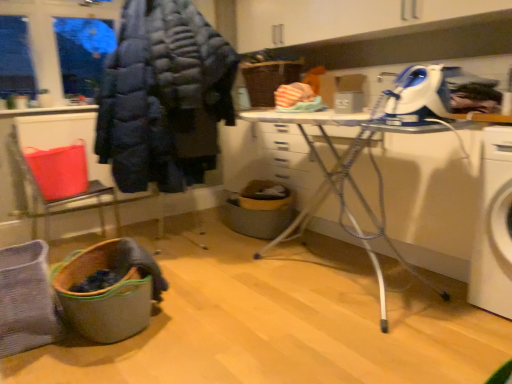
Find the location of a particular element. Image resolution: width=512 pixels, height=384 pixels. matte plastic chair at lower left is located at coordinates (61, 182).

This screenshot has height=384, width=512. What do you see at coordinates (309, 143) in the screenshot? I see `white plastic ironing board at center` at bounding box center [309, 143].

What is the approximate width of blue plastic iron at upper right?

blue plastic iron at upper right is 15.71 inches in width.

Describe the element at coordinates (418, 96) in the screenshot. I see `blue plastic iron at upper right` at that location.

Locate an element on the screen. wooden laundry basket at lower left is located at coordinates click(x=102, y=297).

Locate an element on the screen. The height and width of the screenshot is (384, 512). matte plastic chair at lower left is located at coordinates pyautogui.click(x=61, y=182).

Which is closer, (x=75, y=264) or (x=424, y=92)?

Point (x=75, y=264) appears to be farther away from the viewer than point (x=424, y=92).

Are wooden laundry basket at lower left and blue plastic iron at upper right beside each other?

No, wooden laundry basket at lower left is not making contact with blue plastic iron at upper right.

Is wooden laundry basket at lower left looking in the opposite direction of blue plastic iron at upper right?

That's not correct — wooden laundry basket at lower left is not looking away from blue plastic iron at upper right.

Is wooden laundry basket at lower left not within blue plastic iron at upper right?

Yes.

Visually, is white plastic ironing board at center positioned to the left or to the right of wooden laundry basket at lower left?

From the image, it's evident that white plastic ironing board at center is to the right of wooden laundry basket at lower left.

Would you say white plastic ironing board at center contains wooden laundry basket at lower left?

No, wooden laundry basket at lower left is not a part of white plastic ironing board at center.

In terms of height, does white plastic ironing board at center look taller or shorter compared to wooden laundry basket at lower left?

In the image, white plastic ironing board at center appears to be taller than wooden laundry basket at lower left.

Consider the image. Is white plastic ironing board at center placed right next to wooden laundry basket at lower left?

There is a gap between white plastic ironing board at center and wooden laundry basket at lower left.

Considering the positions of objects blue plastic iron at upper right and brown woven basket at center in the image provided, who is more to the right, blue plastic iron at upper right or brown woven basket at center?

blue plastic iron at upper right.

How many degrees apart are the facing directions of blue plastic iron at upper right and brown woven basket at center?

There is a 3.76-degree angle between the facing directions of blue plastic iron at upper right and brown woven basket at center.

Which is behind, point (387, 109) or point (255, 70)?

The point (255, 70) is behind.

Which of these two, blue plastic iron at upper right or brown woven basket at center, is thinner?

With smaller width is blue plastic iron at upper right.

Is wooden laundry basket at lower left to the right of dark blue puffer jacket at upper left from the viewer's perspective?

Incorrect, wooden laundry basket at lower left is not on the right side of dark blue puffer jacket at upper left.

Can you confirm if wooden laundry basket at lower left is wider than dark blue puffer jacket at upper left?

In fact, wooden laundry basket at lower left might be narrower than dark blue puffer jacket at upper left.

I want to click on laundry basket lying in front of the dark blue puffer jacket at upper left, so click(102, 297).

Find the location of a particular element. The height and width of the screenshot is (384, 512). sewing machine in front of the dark blue puffer jacket at upper left is located at coordinates (418, 96).

Which point is more distant from viewer, [184,86] or [432,90]?

The point [184,86] is behind.

From the image's perspective, does dark blue puffer jacket at upper left appear lower than blue plastic iron at upper right?

Incorrect, from the image's perspective, dark blue puffer jacket at upper left is higher than blue plastic iron at upper right.

Is dark blue puffer jacket at upper left directly adjacent to blue plastic iron at upper right?

No, dark blue puffer jacket at upper left is not with blue plastic iron at upper right.

Can brown woven basket at center be found inside wooden laundry basket at lower left?

No, brown woven basket at center is located outside of wooden laundry basket at lower left.

Considering the positions of points (58, 278) and (298, 63), is point (58, 278) closer to camera compared to point (298, 63)?

That is True.

Measure the distance from wooden laundry basket at lower left to brown woven basket at center.

wooden laundry basket at lower left is 1.91 meters away from brown woven basket at center.

Which object is closer to the camera taking this photo, wooden laundry basket at lower left or brown woven basket at center?

wooden laundry basket at lower left is more forward.

From a real-world perspective, is dark blue puffer jacket at upper left below brown woven basket at center?

Yes, from a real-world perspective, dark blue puffer jacket at upper left is beneath brown woven basket at center.

In the scene shown: From the image's perspective, is dark blue puffer jacket at upper left under brown woven basket at center?

Yes.

Is dark blue puffer jacket at upper left taller than brown woven basket at center?

Yes.

Find the location of a particular element. This screenshot has height=384, width=512. basket above the dark blue puffer jacket at upper left (from the image's perspective) is located at coordinates (268, 80).

Identify the location of sewing machine positioned vertically above the wooden laundry basket at lower left (from a real-world perspective). This screenshot has height=384, width=512. (418, 96).

At what (x,y) coordinates should I click in order to perform the action: click on table that is behind the wooden laundry basket at lower left. Please return your answer as a coordinate pair (x, y). Looking at the image, I should click on (309, 143).

When comparing their distances from brown woven basket at center, does matte plastic chair at lower left or dark blue puffer jacket at upper left seem further?

Based on the image, matte plastic chair at lower left appears to be further to brown woven basket at center.

Estimate the real-world distances between objects in this image. Which object is closer to white plastic ironing board at center, brown woven basket at center or blue plastic iron at upper right?

Among the two, brown woven basket at center is located nearer to white plastic ironing board at center.

Which object lies nearer to the anchor point matte plastic chair at lower left, dark blue puffer jacket at upper left or brown woven basket at center?

dark blue puffer jacket at upper left lies closer to matte plastic chair at lower left than the other object.

In the scene shown: Which object lies nearer to the anchor point blue plastic iron at upper right, matte plastic chair at lower left or dark blue puffer jacket at upper left?

dark blue puffer jacket at upper left lies closer to blue plastic iron at upper right than the other object.

When comparing their distances from matte plastic chair at lower left, does blue plastic iron at upper right or dark blue puffer jacket at upper left seem closer?

dark blue puffer jacket at upper left is positioned closer to the anchor matte plastic chair at lower left.

When comparing their distances from brown woven basket at center, does blue plastic iron at upper right or white plastic ironing board at center seem further?

Based on the image, blue plastic iron at upper right appears to be further to brown woven basket at center.

From the image, which object appears to be farther from white plastic ironing board at center, wooden laundry basket at lower left or brown woven basket at center?

wooden laundry basket at lower left is positioned further to the anchor white plastic ironing board at center.

From the image, which object appears to be nearer to dark blue puffer jacket at upper left, blue plastic iron at upper right or matte plastic chair at lower left?

Based on the image, matte plastic chair at lower left appears to be nearer to dark blue puffer jacket at upper left.

Identify the location of laundry basket between matte plastic chair at lower left and blue plastic iron at upper right from left to right. The image size is (512, 384). (102, 297).

I want to click on table between wooden laundry basket at lower left and brown woven basket at center from front to back, so click(x=309, y=143).

Find the location of a particular element. clothing between white plastic ironing board at center and brown woven basket at center along the z-axis is located at coordinates 164,97.

Where is `clothing between matte plastic chair at lower left and brown woven basket at center from left to right`? This screenshot has width=512, height=384. clothing between matte plastic chair at lower left and brown woven basket at center from left to right is located at coordinates (164, 97).